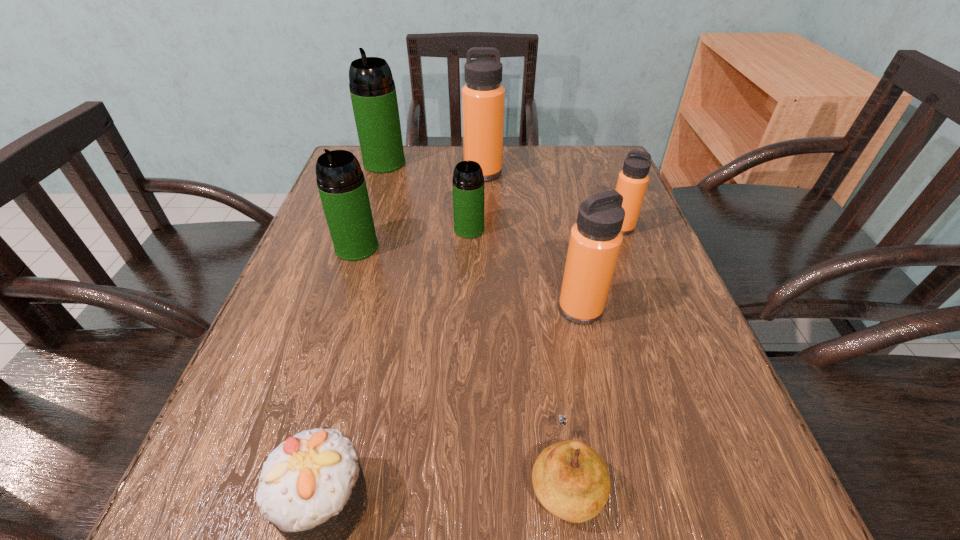
I want to click on the farthest green thermos bottle, so click(x=373, y=94).

Find the location of `the farthest orange thermos bottle`. the farthest orange thermos bottle is located at coordinates (483, 96).

You are a GUI agent. You are given a task and a screenshot of the screen. Output one action in this format:
    pyautogui.click(x=<x>, y=<y>)
    Task: Click on the leftmost orange thermos bottle
    The image size is (960, 540).
    Given the screenshot: What is the action you would take?
    pyautogui.click(x=483, y=96)

The width and height of the screenshot is (960, 540). Find the location of `the second smallest green thermos bottle`. the second smallest green thermos bottle is located at coordinates (341, 183).

Where is `the second biggest orange thermos bottle`? Image resolution: width=960 pixels, height=540 pixels. the second biggest orange thermos bottle is located at coordinates (596, 238).

Locate an element on the screen. The height and width of the screenshot is (540, 960). the nearest thermos bottle is located at coordinates (596, 238).

The height and width of the screenshot is (540, 960). In order to click on the rightmost green thermos bottle in this screenshot , I will do `click(468, 182)`.

At what (x,y) coordinates should I click in order to perform the action: click on the rightmost orange thermos bottle. Please return your answer as a coordinate pair (x, y). Looking at the image, I should click on (632, 182).

Find the location of `the rightmost thermos bottle`. the rightmost thermos bottle is located at coordinates tap(632, 182).

Locate an element on the screen. This screenshot has height=540, width=960. pear is located at coordinates (571, 480).